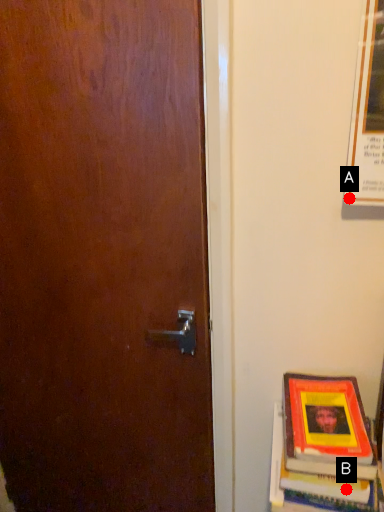
Question: Two points are circled on the image, labeled by A and B beside each circle. Which point is closer to the camera?

Choices:
 (A) A is closer
 (B) B is closer

Answer: (B)